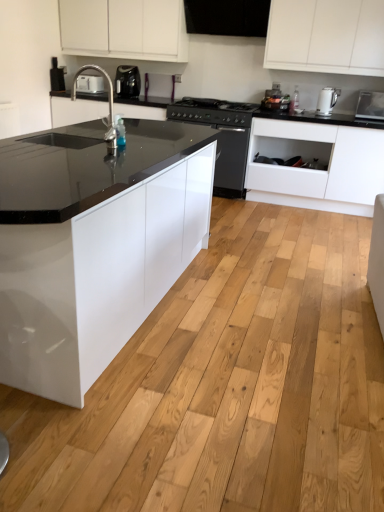
You are a GUI agent. You are given a task and a screenshot of the screen. Output one action in this format:
    pyautogui.click(x=<x>, y=<y>)
    Task: Click on the white glossy cabinet at upper center, positioned as the 2th cabinetry in right-to-left order
    This screenshot has width=384, height=512.
    Given the screenshot: What is the action you would take?
    pyautogui.click(x=124, y=29)

Describe the element at coordinates (90, 83) in the screenshot. The height and width of the screenshot is (512, 384). I see `white plastic toaster at upper left, marked as the 2th appliance in a right-to-left arrangement` at that location.

Describe the element at coordinates (109, 105) in the screenshot. This screenshot has height=512, width=384. I see `silver metallic faucet at center` at that location.

Where is `black matte stove at center`? The width and height of the screenshot is (384, 512). black matte stove at center is located at coordinates (212, 112).

I want to click on white glossy cabinet at upper center, placed as the 1th cabinetry when sorted from top to bottom, so click(x=124, y=29).

Who is bigger, white glossy cabinet at upper center, which ranks as the first cabinetry in left-to-right order, or satin silver toaster at upper right, the 1th appliance in the right-to-left sequence?

white glossy cabinet at upper center, which ranks as the first cabinetry in left-to-right order, is bigger.

Image resolution: width=384 pixels, height=512 pixels. In order to click on appliance on the right of white glossy cabinet at upper center, which appears as the second cabinetry when ordered from the bottom in this screenshot , I will do `click(370, 105)`.

From the image's perspective, is white glossy cabinet at upper center, placed as the 1th cabinetry when sorted from top to bottom, on satin silver toaster at upper right, the 2th appliance from the left?

Correct, white glossy cabinet at upper center, placed as the 1th cabinetry when sorted from top to bottom, appears higher than satin silver toaster at upper right, the 2th appliance from the left, in the image.

Which object is positioned more to the right, transparent plastic bottle at center or satin silver toaster at upper right, the 2th appliance from the left?

From the viewer's perspective, satin silver toaster at upper right, the 2th appliance from the left, appears more on the right side.

From the picture: Can you confirm if transparent plastic bottle at center is smaller than satin silver toaster at upper right, which is the 2th appliance in top-to-bottom order?

Correct, transparent plastic bottle at center occupies less space than satin silver toaster at upper right, which is the 2th appliance in top-to-bottom order.

From the image's perspective, is transparent plastic bottle at center located above or below satin silver toaster at upper right, placed as the 1th appliance when sorted from front to back?

From the image's perspective, transparent plastic bottle at center appears above satin silver toaster at upper right, placed as the 1th appliance when sorted from front to back.

Is transparent plastic bottle at center aimed at satin silver toaster at upper right, the first appliance from the bottom?

No, transparent plastic bottle at center is not aimed at satin silver toaster at upper right, the first appliance from the bottom.

Considering the positions of point (121, 72) and point (322, 101), is point (121, 72) closer or farther from the camera than point (322, 101)?

Clearly, point (121, 72) is more distant from the camera than point (322, 101).

Does black plastic coffee maker at upper center, the 2th kitchen appliance from the front, lie behind white glossy electric kettle at upper right, which is the second kitchen appliance in left-to-right order?

Yes, it is.

Can you confirm if black plastic coffee maker at upper center, which is counted as the first kitchen appliance, starting from the back, is positioned to the right of white glossy electric kettle at upper right, marked as the 2th kitchen appliance in a back-to-front arrangement?

No, black plastic coffee maker at upper center, which is counted as the first kitchen appliance, starting from the back, is not to the right of white glossy electric kettle at upper right, marked as the 2th kitchen appliance in a back-to-front arrangement.

This screenshot has width=384, height=512. What are the coordinates of `kitchen appliance that is under the black plastic coffee maker at upper center, the 2th kitchen appliance from the front (from a real-world perspective)` in the screenshot? It's located at (327, 100).

Is black matte stove at center smaller than black glossy dishwasher at center?

Correct, black matte stove at center occupies less space than black glossy dishwasher at center.

Find the location of a particular element. This screenshot has width=384, height=512. stove above the black glossy dishwasher at center (from the image's perspective) is located at coordinates (212, 112).

Does black matte stove at center turn towards black glossy dishwasher at center?

No.

Consider the image. Can you confirm if black matte stove at center is taller than white matte cabinet at center, which is the first cabinetry in right-to-left order?

No, black matte stove at center is not taller than white matte cabinet at center, which is the first cabinetry in right-to-left order.

The image size is (384, 512). I want to click on stove that appears behind the white matte cabinet at center, which is the 2th cabinetry in top-to-bottom order, so click(x=212, y=112).

Considering the sizes of black matte stove at center and white matte cabinet at center, which appears as the 1th cabinetry when ordered from the bottom, in the image, is black matte stove at center bigger or smaller than white matte cabinet at center, which appears as the 1th cabinetry when ordered from the bottom,?

Considering their sizes, black matte stove at center takes up less space than white matte cabinet at center, which appears as the 1th cabinetry when ordered from the bottom.

At what (x,y) coordinates should I click in order to perform the action: click on kitchen appliance below the black plastic coffee maker at upper center, which is counted as the first kitchen appliance, starting from the back (from a real-world perspective). Please return your answer as a coordinate pair (x, y). The width and height of the screenshot is (384, 512). Looking at the image, I should click on (327, 100).

Which is more to the right, white glossy electric kettle at upper right, which appears as the 1th kitchen appliance when viewed from the right, or black plastic coffee maker at upper center, the first kitchen appliance when ordered from top to bottom?

From the viewer's perspective, white glossy electric kettle at upper right, which appears as the 1th kitchen appliance when viewed from the right, appears more on the right side.

Can you confirm if white glossy electric kettle at upper right, the first kitchen appliance in the front-to-back sequence, is shorter than black plastic coffee maker at upper center, the 2th kitchen appliance from the front?

Yes, white glossy electric kettle at upper right, the first kitchen appliance in the front-to-back sequence, is shorter than black plastic coffee maker at upper center, the 2th kitchen appliance from the front.

Can you confirm if white glossy electric kettle at upper right, which is the second kitchen appliance in left-to-right order, is thinner than black plastic coffee maker at upper center, which is counted as the first kitchen appliance, starting from the back?

Yes.

Which object is more forward, black plastic coffee maker at upper center, the second kitchen appliance when ordered from bottom to top, or white plastic toaster at upper left, marked as the 1th appliance in a left-to-right arrangement?

black plastic coffee maker at upper center, the second kitchen appliance when ordered from bottom to top.

Which of these two, black plastic coffee maker at upper center, the 2th kitchen appliance from the front, or white plastic toaster at upper left, which is counted as the 1th appliance, starting from the top, is bigger?

With larger size is black plastic coffee maker at upper center, the 2th kitchen appliance from the front.

Is point (132, 69) less distant than point (89, 85)?

That is True.

Identify the location of appliance that is the 1st object directly below the white glossy cabinet at upper center, placed as the 1th cabinetry when sorted from top to bottom (from a real-world perspective). This screenshot has width=384, height=512. (370, 105).

You are a GUI agent. You are given a task and a screenshot of the screen. Output one action in this format:
    pyautogui.click(x=<x>, y=<y>)
    Task: Click on the bottle above the satin silver toaster at upper right, placed as the 1th appliance when sorted from front to back (from the image's perspective)
    This screenshot has height=512, width=384.
    Given the screenshot: What is the action you would take?
    pyautogui.click(x=295, y=99)

Looking at this image, estimate the real-world distances between objects in this image. Which object is further from white plastic toaster at upper left, marked as the 2th appliance in a right-to-left arrangement, satin silver toaster at upper right, placed as the 1th appliance when sorted from front to back, or silver metallic faucet at center?

satin silver toaster at upper right, placed as the 1th appliance when sorted from front to back, lies further to white plastic toaster at upper left, marked as the 2th appliance in a right-to-left arrangement, than the other object.

Which object lies further to the anchor point black matte stove at center, black plastic coffee maker at upper center, the second kitchen appliance when ordered from right to left, or satin silver toaster at upper right, the first appliance from the bottom?

The object further to black matte stove at center is satin silver toaster at upper right, the first appliance from the bottom.

Based on their spatial positions, is black matte stove at center or satin silver toaster at upper right, the 2th appliance from the left, further from white plastic toaster at upper left, which is the second appliance in bottom-to-top order?

Based on the image, satin silver toaster at upper right, the 2th appliance from the left, appears to be further to white plastic toaster at upper left, which is the second appliance in bottom-to-top order.

Based on their spatial positions, is black matte stove at center or black glossy dishwasher at center closer to silver metallic faucet at center?

black matte stove at center.

Estimate the real-world distances between objects in this image. Which object is closer to satin silver toaster at upper right, the 1th appliance in the right-to-left sequence, silver metallic faucet at center or black matte stove at center?

black matte stove at center is closer to satin silver toaster at upper right, the 1th appliance in the right-to-left sequence.

Based on their spatial positions, is transparent plastic bottle at center or white matte cabinet at center, which is the 2th cabinetry in top-to-bottom order, further from white plastic toaster at upper left, which is the second appliance in bottom-to-top order?

Among the two, white matte cabinet at center, which is the 2th cabinetry in top-to-bottom order, is located further to white plastic toaster at upper left, which is the second appliance in bottom-to-top order.

From the image, which object appears to be farther from silver metallic faucet at center, black glossy dishwasher at center or black matte stove at center?

black glossy dishwasher at center is positioned further to the anchor silver metallic faucet at center.

In the scene shown: When comparing their distances from white glossy cabinet at upper center, placed as the 1th cabinetry when sorted from top to bottom, does black glossy dishwasher at center or silver metallic faucet at center seem closer?

silver metallic faucet at center.

Locate an element on the screen. The width and height of the screenshot is (384, 512). stove between silver metallic faucet at center and transparent plastic bottle at center in the front-back direction is located at coordinates (212, 112).

Locate an element on the screen. The image size is (384, 512). bottle between white glossy cabinet at upper center, placed as the 1th cabinetry when sorted from top to bottom, and white matte cabinet at center, which appears as the 1th cabinetry when ordered from the bottom, from left to right is located at coordinates (295, 99).

Find the location of `bottle located between white glossy cabinet at upper center, positioned as the 2th cabinetry in right-to-left order, and satin silver toaster at upper right, the first appliance from the bottom, in the left-right direction`. bottle located between white glossy cabinet at upper center, positioned as the 2th cabinetry in right-to-left order, and satin silver toaster at upper right, the first appliance from the bottom, in the left-right direction is located at coordinates 295,99.

The image size is (384, 512). Identify the location of kitchen appliance between black glossy dishwasher at center and satin silver toaster at upper right, the first appliance from the bottom, from left to right. (327, 100).